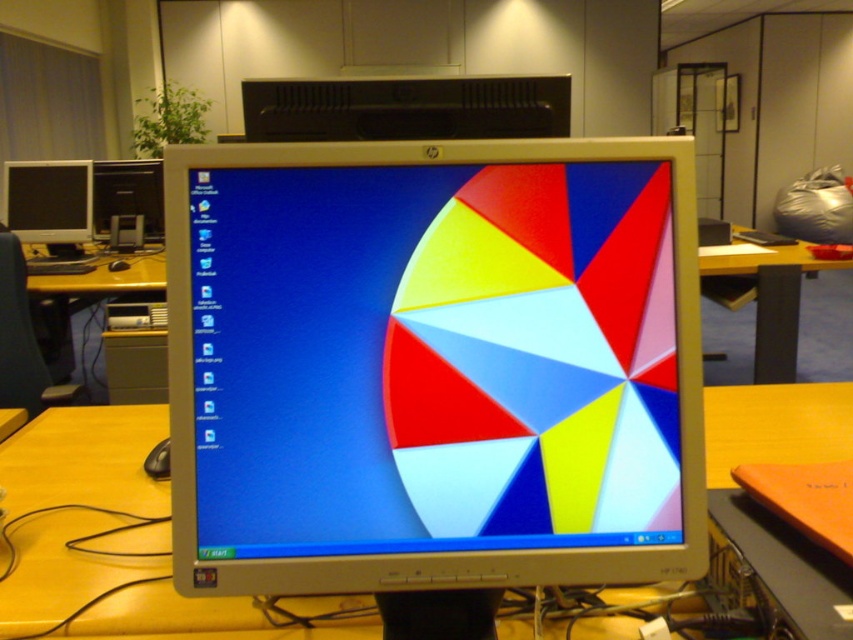
Question: Which object is the farthest from the matte black monitor at upper left?

Choices:
 (A) black plastic speaker at upper center
 (B) wooden at center
 (C) matte plastic monitor at center
 (D) wooden table at center

Answer: (C)

Question: Is yellow wood table at left positioned at the back of matte black monitor at upper left?

Choices:
 (A) no
 (B) yes

Answer: (A)

Question: Which of these objects is positioned farthest from the wooden at center?

Choices:
 (A) matte black monitor at upper left
 (B) matte black monitor at left
 (C) wooden table at center
 (D) yellow wood table at left

Answer: (A)

Question: Is wooden at center above matte black monitor at left?

Choices:
 (A) no
 (B) yes

Answer: (A)

Question: Does matte black monitor at left appear over yellow wood table at left?

Choices:
 (A) yes
 (B) no

Answer: (A)

Question: Which point appears closest to the camera in this image?

Choices:
 (A) (59, 205)
 (B) (119, 170)

Answer: (A)